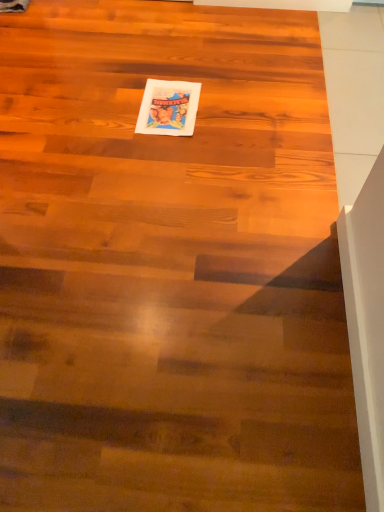
The image size is (384, 512). What are the coordinates of `empty space that is to the right of white paper book at center` in the screenshot? It's located at tap(230, 106).